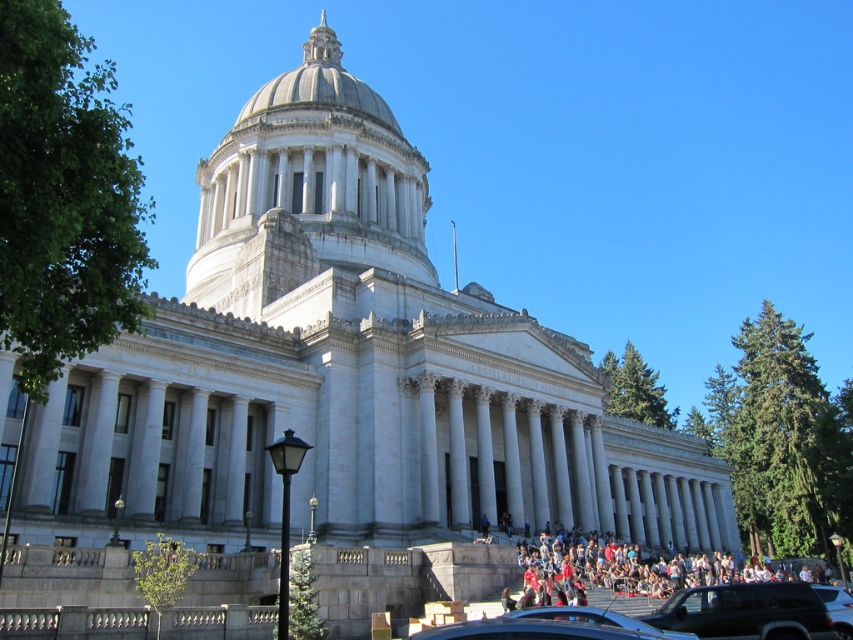
You are standing at the base of the grand neoclassical building and notice a green leafy tree at left and a white marble dome at center. From your vantage point, which object appears higher in the scene?

The green leafy tree at left appears higher than the white marble dome at center because it is located above it in the scene.